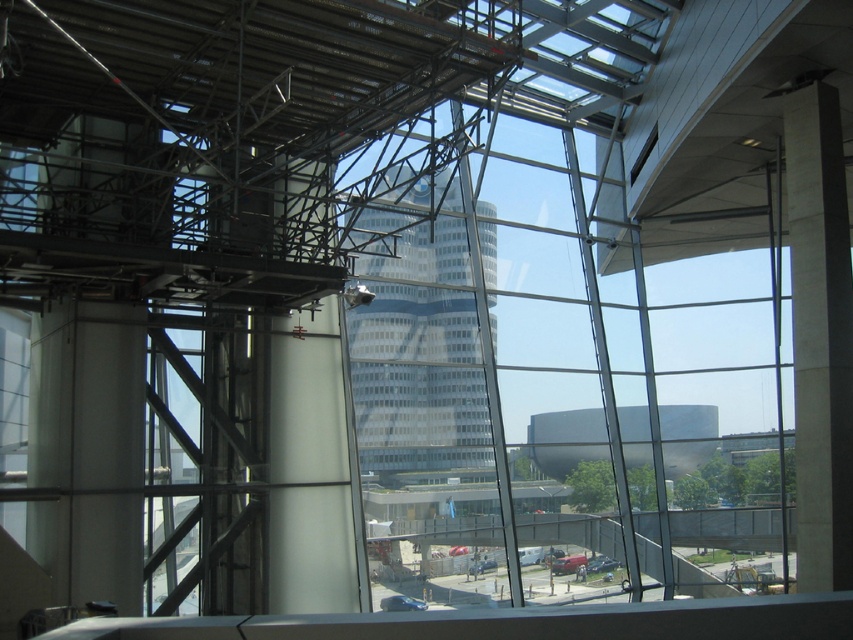
You are standing inside the modern building looking out through the large glass windows. There is a point marked at coordinates (456, 445) in your field of view. If you want to reach that point, which is 15.55 meters away from your current position, can you walk straight towards it from where you are standing?

The point at (456, 445) is 15.55 meters away from the camera. Since the path is through the glass window and the point is outside the building, you cannot walk straight towards it from your current position inside the building.

You are standing inside the modern building and looking out through the large glass windows. You notice the white glass tower at center. Based on its position in the image, can you determine if it is directly in front of you or to one side?

The white glass tower at center is located at point coordinates approximately 0.541 on the horizontal axis and 0.492 on the vertical axis. Since the coordinates are close to the center of the image, it suggests that the white glass tower at center is directly in front of you rather than to one side.